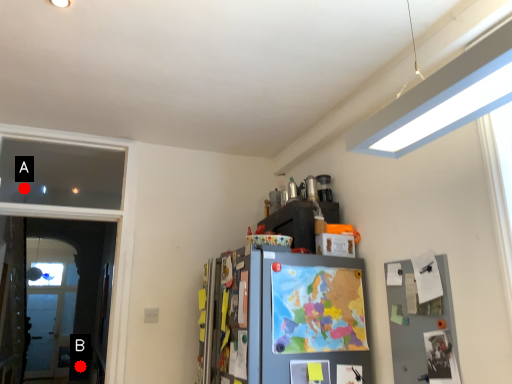
Question: Two points are circled on the image, labeled by A and B beside each circle. Which point appears closest to the camera in this image?

Choices:
 (A) A is closer
 (B) B is closer

Answer: (A)